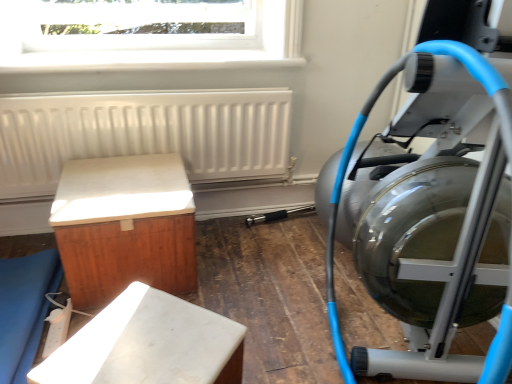
Question: Should I look upward or downward to see transparent glass window at upper center?

Choices:
 (A) up
 (B) down

Answer: (A)

Question: Can you confirm if transparent glass window at upper center is shorter than matte wood bench at lower left, which is the first furniture from left to right?

Choices:
 (A) no
 (B) yes

Answer: (A)

Question: From a real-world perspective, does transparent glass window at upper center sit lower than matte wood bench at lower left, the 3th furniture when ordered from right to left?

Choices:
 (A) yes
 (B) no

Answer: (B)

Question: Is transparent glass window at upper center positioned in front of matte wood bench at lower left, which is the first furniture from left to right?

Choices:
 (A) no
 (B) yes

Answer: (A)

Question: Is transparent glass window at upper center smaller than matte wood bench at lower left, which is the first furniture from left to right?

Choices:
 (A) no
 (B) yes

Answer: (B)

Question: From the image's perspective, is transparent glass window at upper center under matte wood bench at lower left, the 3th furniture when ordered from right to left?

Choices:
 (A) no
 (B) yes

Answer: (A)

Question: Could matte wood bench at lower left, the 3th furniture when ordered from right to left, be considered to be inside transparent glass window at upper center?

Choices:
 (A) yes
 (B) no

Answer: (B)

Question: Can you confirm if silver metallic stationary bicycle at right is taller than matte wood bench at lower left, the 3th furniture when ordered from right to left?

Choices:
 (A) no
 (B) yes

Answer: (B)

Question: Is silver metallic stationary bicycle at right further to the viewer compared to matte wood bench at lower left, which is the first furniture from left to right?

Choices:
 (A) yes
 (B) no

Answer: (B)

Question: Considering the relative sizes of silver metallic stationary bicycle at right and matte wood bench at lower left, the 3th furniture when ordered from right to left, in the image provided, is silver metallic stationary bicycle at right bigger than matte wood bench at lower left, the 3th furniture when ordered from right to left,?

Choices:
 (A) yes
 (B) no

Answer: (A)

Question: Is silver metallic stationary bicycle at right outside of matte wood bench at lower left, which is the first furniture from left to right?

Choices:
 (A) no
 (B) yes

Answer: (B)

Question: Are silver metallic stationary bicycle at right and matte wood bench at lower left, which is the first furniture from left to right, located far from each other?

Choices:
 (A) no
 (B) yes

Answer: (B)

Question: Could you tell me if silver metallic stationary bicycle at right is facing matte wood bench at lower left, the 3th furniture when ordered from right to left?

Choices:
 (A) yes
 (B) no

Answer: (A)

Question: Does silver metallic stationary bicycle at right have a larger size compared to white matte cabinet at left, marked as the 2th furniture in a left-to-right arrangement?

Choices:
 (A) yes
 (B) no

Answer: (A)